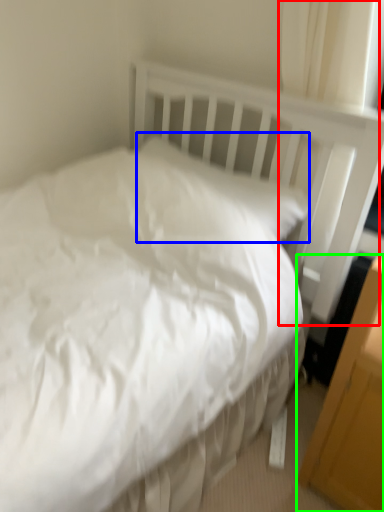
Question: Based on their relative distances, which object is farther from curtain (highlighted by a red box)? Choose from pillow (highlighted by a blue box) and file cabinet (highlighted by a green box).

Choices:
 (A) pillow
 (B) file cabinet

Answer: (B)